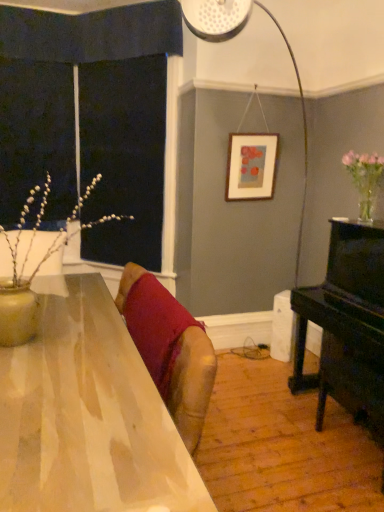
Question: Is black polished piano at right bigger than shiny wooden table at center?

Choices:
 (A) yes
 (B) no

Answer: (B)

Question: Is black polished piano at right at the right side of shiny wooden table at center?

Choices:
 (A) no
 (B) yes

Answer: (B)

Question: Can you confirm if black polished piano at right is taller than shiny wooden table at center?

Choices:
 (A) no
 (B) yes

Answer: (B)

Question: Is shiny wooden table at center surrounded by black polished piano at right?

Choices:
 (A) yes
 (B) no

Answer: (B)

Question: Considering the relative positions of black polished piano at right and shiny wooden table at center in the image provided, is black polished piano at right behind shiny wooden table at center?

Choices:
 (A) yes
 (B) no

Answer: (A)

Question: Considering the relative sizes of black polished piano at right and shiny wooden table at center in the image provided, is black polished piano at right shorter than shiny wooden table at center?

Choices:
 (A) no
 (B) yes

Answer: (A)

Question: Considering the relative sizes of matte wooden picture frame at upper center and black polished piano at right in the image provided, is matte wooden picture frame at upper center smaller than black polished piano at right?

Choices:
 (A) yes
 (B) no

Answer: (A)

Question: Considering the relative positions of matte wooden picture frame at upper center and black polished piano at right in the image provided, is matte wooden picture frame at upper center in front of black polished piano at right?

Choices:
 (A) no
 (B) yes

Answer: (A)

Question: Can you confirm if matte wooden picture frame at upper center is shorter than black polished piano at right?

Choices:
 (A) no
 (B) yes

Answer: (B)

Question: Can you confirm if matte wooden picture frame at upper center is positioned to the left of black polished piano at right?

Choices:
 (A) no
 (B) yes

Answer: (B)

Question: From the image's perspective, would you say matte wooden picture frame at upper center is positioned over black polished piano at right?

Choices:
 (A) yes
 (B) no

Answer: (A)

Question: Is black polished piano at right at the back of matte wooden picture frame at upper center?

Choices:
 (A) no
 (B) yes

Answer: (A)

Question: Is velvet red cushion at center closer to camera compared to shiny wooden table at center?

Choices:
 (A) no
 (B) yes

Answer: (A)